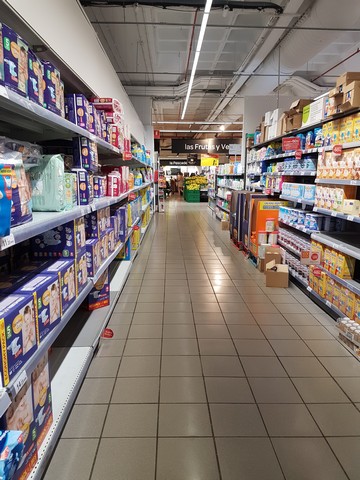
Locate an element on the screen. This screenshot has height=480, width=360. 1 long white light is located at coordinates (189, 91).